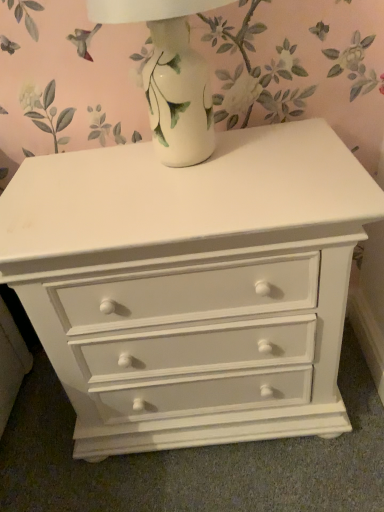
Where is `vacant space positioned to the left of white glossy vase at upper center`? This screenshot has width=384, height=512. vacant space positioned to the left of white glossy vase at upper center is located at coordinates (69, 182).